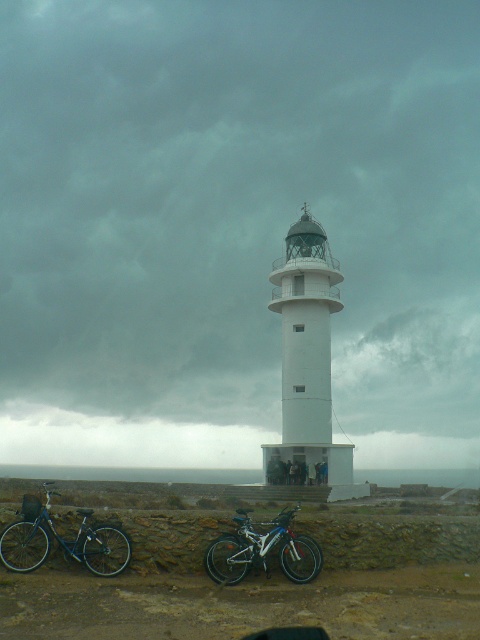
Question: Which point is farther to the camera?

Choices:
 (A) shiny black bicycle at lower left
 (B) white smooth lighthouse at center
 (C) white matte lighthouse at center
 (D) dark gray stone couple at center

Answer: (C)

Question: Is white matte lighthouse at center thinner than dark gray stone couple at center?

Choices:
 (A) yes
 (B) no

Answer: (B)

Question: Which point is farther to the camera?

Choices:
 (A) (225, 173)
 (B) (302, 467)
 (C) (338, 268)

Answer: (A)

Question: Can you confirm if white smooth lighthouse at center is bigger than shiny black bicycle at lower left?

Choices:
 (A) no
 (B) yes

Answer: (B)

Question: Is shiny black bicycle at lower left smaller than dark gray stone couple at center?

Choices:
 (A) no
 (B) yes

Answer: (A)

Question: Among these points, which one is farthest from the camera?

Choices:
 (A) (133, 541)
 (B) (300, 221)
 (C) (444, 300)
 (D) (32, 566)

Answer: (C)